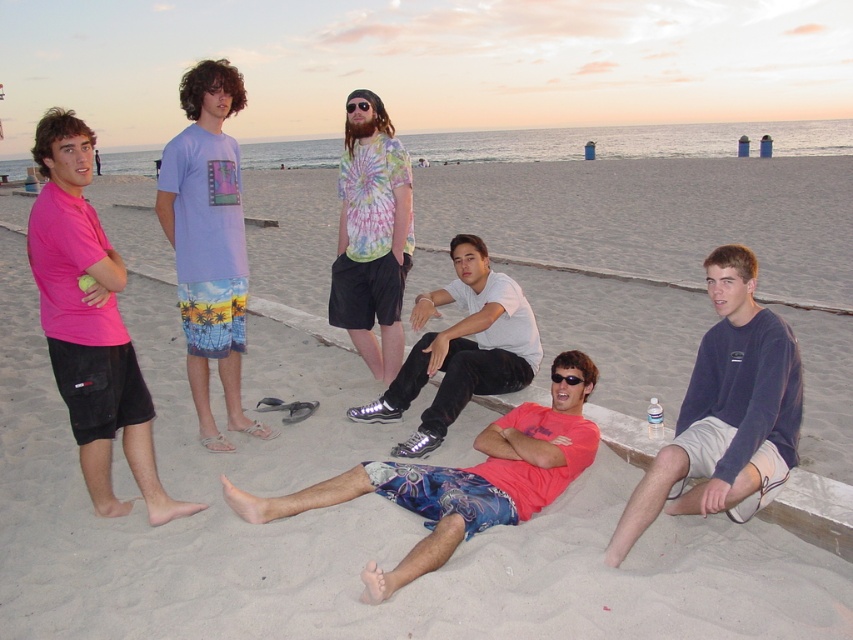
You are standing at the origin point of the coordinate system. The purple tie dye t shirt at center is located at point [207,241]. Can you determine the direction of the purple tie dye t shirt at center relative to your current position?

The purple tie dye t shirt at center is located at point [207,241], which means it is northeast of your current position at the origin point.

You are a photographer trying to capture the group on the beach. You want to ensure that both the pink matte shorts at left and the white matte shirt at center are clearly visible in the frame. Given their sizes, which item might require you to adjust your camera angle to avoid being too small in the photo?

The pink matte shorts at left are smaller in width than the white matte shirt at center, so you may need to adjust your camera angle to ensure the pink matte shorts at left are not too small in the photo.